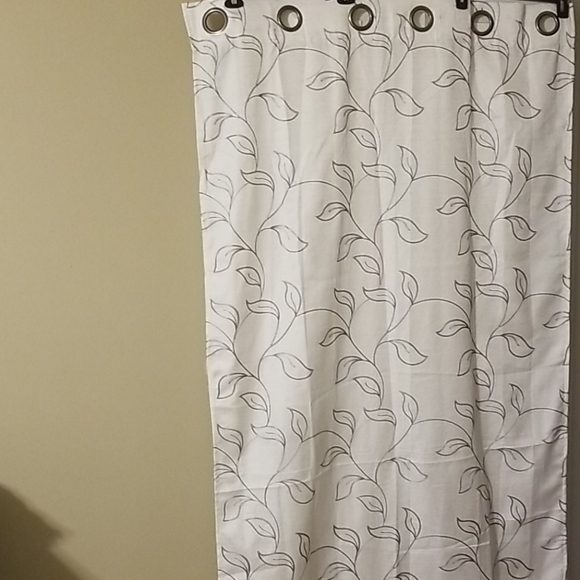
I want to click on left side of curtain, so point(206,409).